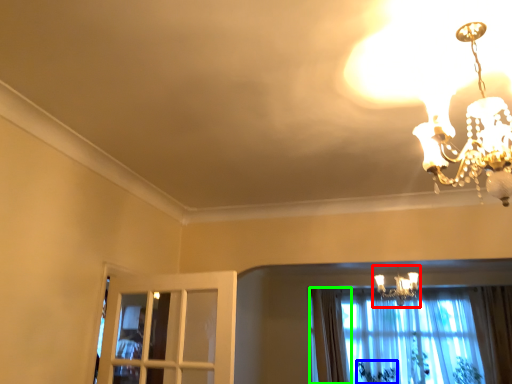
Question: Which object is the closest to the lamp (highlighted by a red box)? Choose among these: plant (highlighted by a blue box) or curtain (highlighted by a green box).

Choices:
 (A) plant
 (B) curtain

Answer: (B)